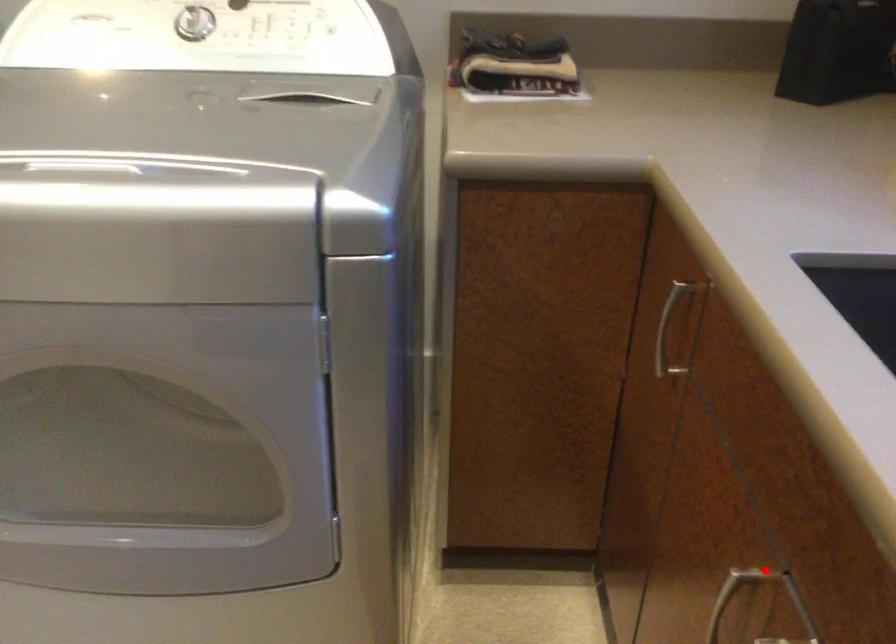
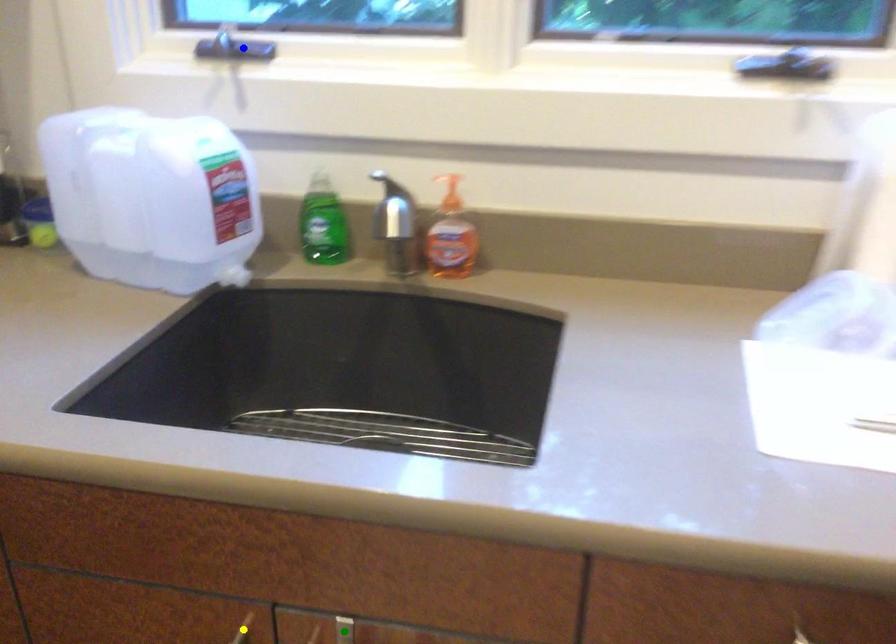
Question: I am providing you with two images of the same scene from different viewpoints. A red point is marked on the first image. You are given multiple points on the second image. In image 2, which mark is for the same physical point as the one in image 1?

Choices:
 (A) yellow point
 (B) blue point
 (C) green point

Answer: (A)